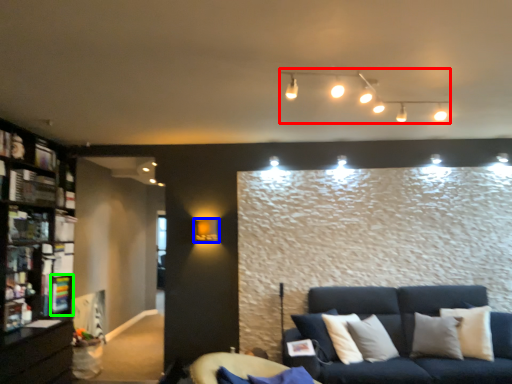
Question: Estimate the real-world distances between objects in this image. Which object is farther from lamp (highlighted by a red box), lamp (highlighted by a blue box) or shelf (highlighted by a green box)?

Choices:
 (A) lamp
 (B) shelf

Answer: (B)